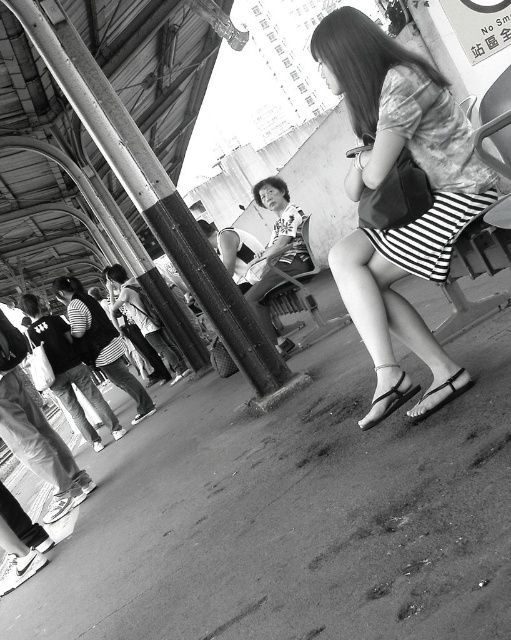
Between matte striped skirt at center and black leather sandal at lower center, which one has more height?

Standing taller between the two is matte striped skirt at center.

Image resolution: width=511 pixels, height=640 pixels. Find the location of `matte striped skirt at center`. matte striped skirt at center is located at coordinates (388, 172).

Which is behind, point (392, 77) or point (427, 397)?

Point (427, 397)

Who is higher up, matte striped skirt at center or metallic silver sandal at lower center?

Positioned higher is matte striped skirt at center.

Which is in front, point (434, 275) or point (462, 381)?

Point (434, 275) is more forward.

Image resolution: width=511 pixels, height=640 pixels. I want to click on matte striped skirt at center, so 388,172.

The image size is (511, 640). What do you see at coordinates (387, 396) in the screenshot?
I see `black leather sandal at lower center` at bounding box center [387, 396].

Does black leather sandal at lower center appear on the left side of metallic silver sandal at lower center?

Yes, black leather sandal at lower center is to the left of metallic silver sandal at lower center.

What do you see at coordinates (387, 396) in the screenshot? I see `black leather sandal at lower center` at bounding box center [387, 396].

Where is `black leather sandal at lower center`? black leather sandal at lower center is located at coordinates (387, 396).